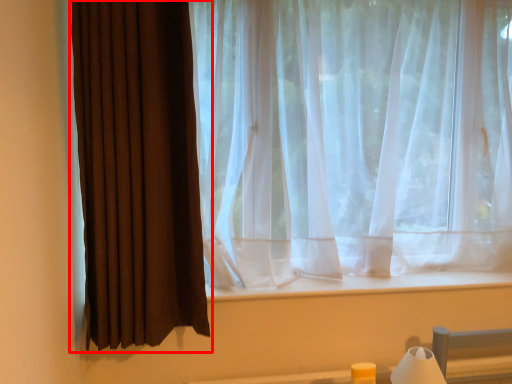
Question: Considering the relative positions of curtain (annotated by the red box) and table lamp in the image provided, where is curtain (annotated by the red box) located with respect to the staircase?

Choices:
 (A) right
 (B) left

Answer: (B)